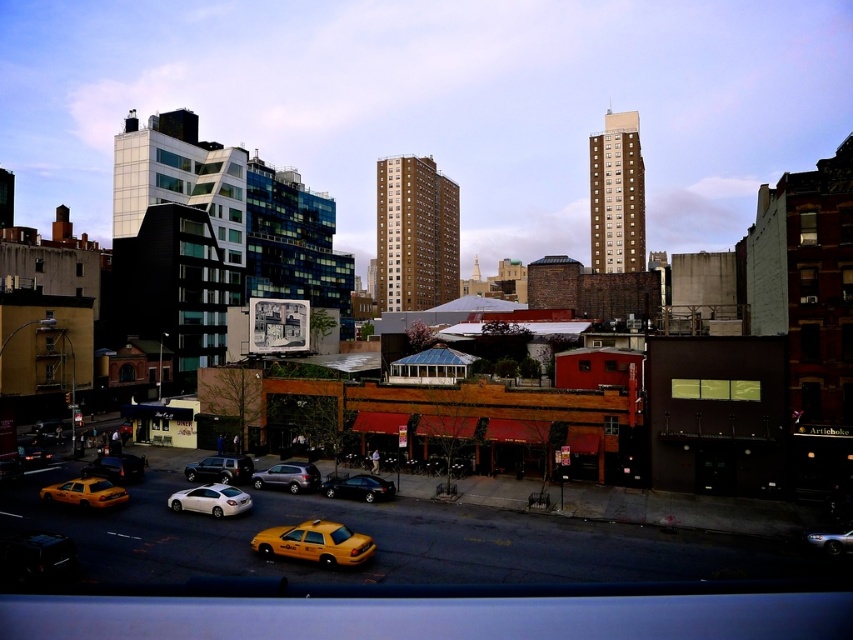
You are standing at the corner of the street and want to hail a taxi. The yellow matte taxi at center is your only option. Based on its position, can you estimate whether it is closer to the left side or the right side of the street?

The yellow matte taxi at center is located at point coordinates that place it closer to the right side of the street since its x coordinate is 0.850, which is closer to the right edge of the image.

You are a delivery driver needing to park your vehicle between the matte black suv at center and the metallic silver car at lower right. Your vehicle is 5 meters long. Is there enough space between them to park your car?

The distance between the matte black suv at center and the metallic silver car at lower right is 33.72 meters. Since your vehicle is only 5 meters long, there is more than enough space to park between them.

You are a delivery driver needing to park your vehicle in the parking spot located to the right of the metallic silver car at lower right. Given that the matte black suv at center is blocking the path, can you safely navigate around it to reach the parking spot?

The matte black suv at center is to the left of the metallic silver car at lower right, so you can safely navigate around the matte black suv at center to reach the parking spot to the right of the metallic silver car at lower right.